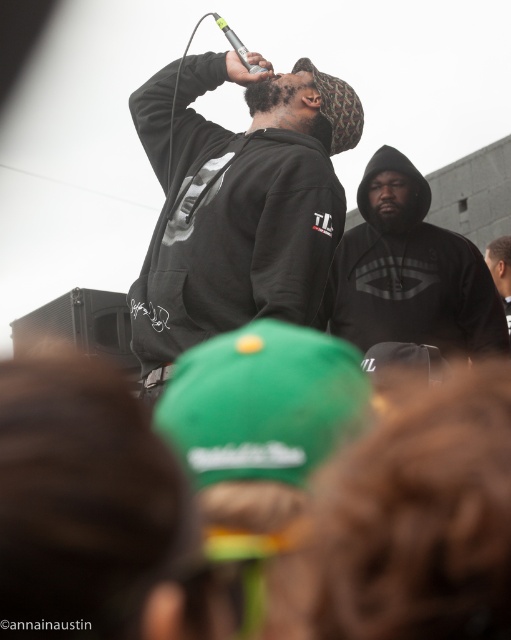
You are standing in the crowd at the live performance. You notice two points in the image, one at coordinate point [261,280] and another at point [363,176]. Which point is closer to you?

Point [261,280] is closer to the viewer than point [363,176].

You are a photographer trying to capture the performer wearing the matte black hoodie at center. However, there is another black matte hoodie at center in the way. Can you still see the performer through the obstruction?

A: The matte black hoodie at center is above the black matte hoodie at center, so yes, the photographer can still see the performer through the obstruction as the upper hoodie is not blocking the entire view.